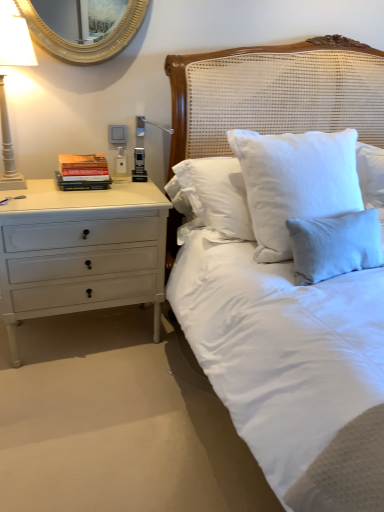
Where is `free location to the right of hardcover books at left`? Image resolution: width=384 pixels, height=512 pixels. free location to the right of hardcover books at left is located at coordinates (127, 186).